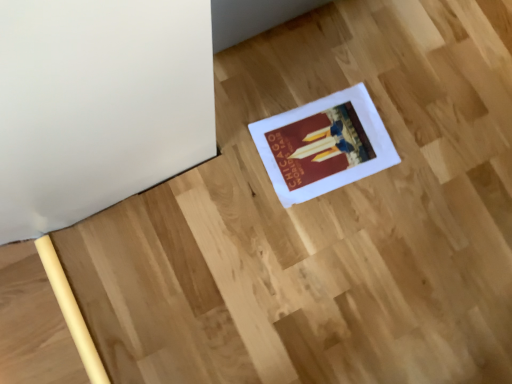
The image size is (512, 384). Identify the location of vacant space underneath white matte picture frame at center (from a real-world perspective). (325, 143).